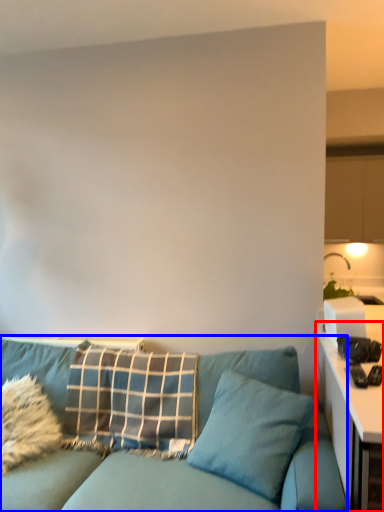
Question: Which point is closer to the camera, table (highlighted by a red box) or studio couch (highlighted by a blue box)?

Choices:
 (A) table
 (B) studio couch

Answer: (A)